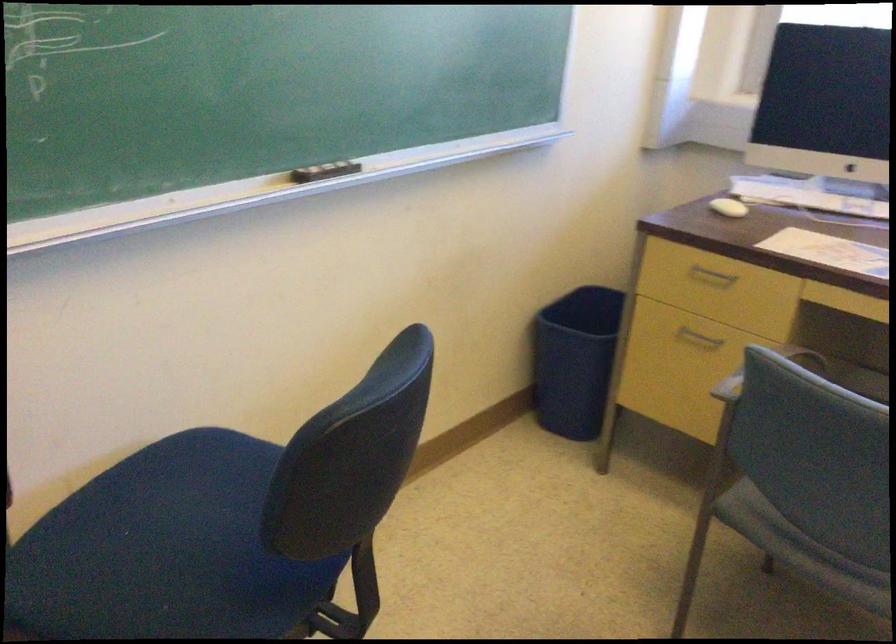
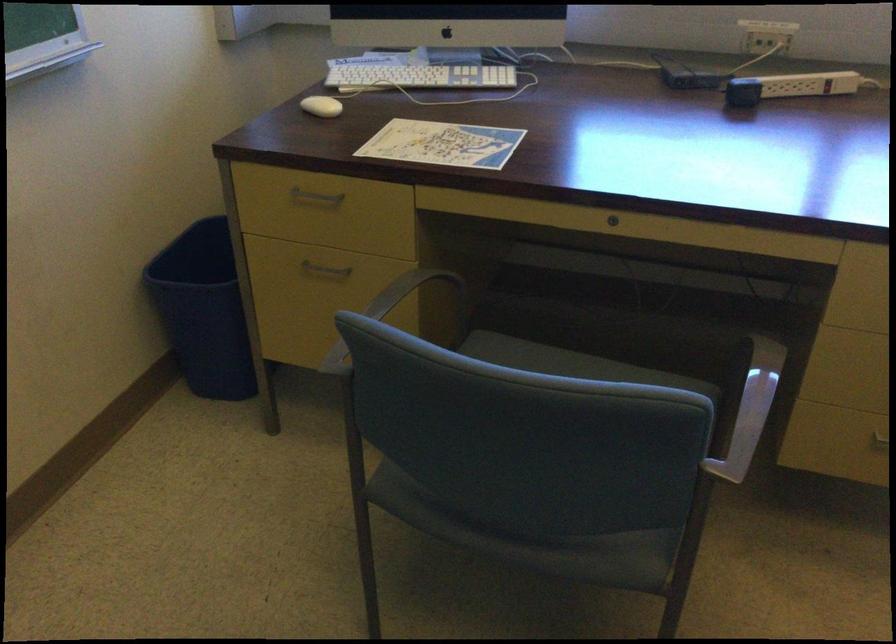
Where in the second image is the point corresponding to point 581,350 from the first image?

(202, 310)